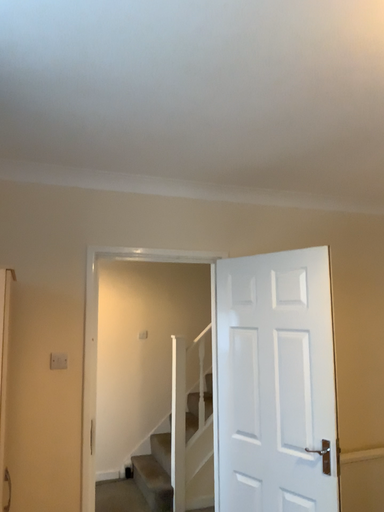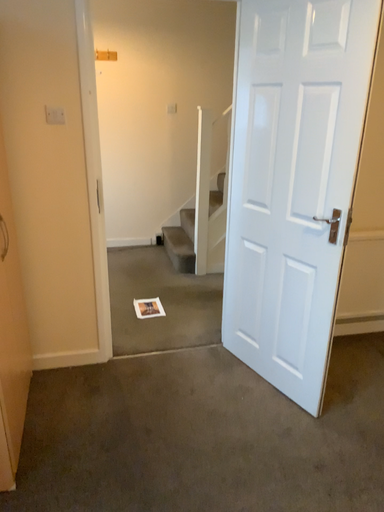
Question: Which way did the camera rotate in the video?

Choices:
 (A) rotated right
 (B) rotated left

Answer: (B)